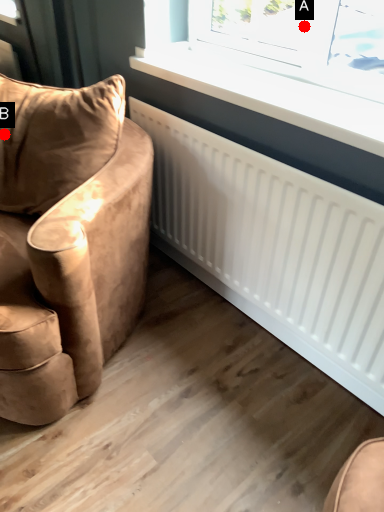
Question: Two points are circled on the image, labeled by A and B beside each circle. Which of the following is the closest to the observer?

Choices:
 (A) A is closer
 (B) B is closer

Answer: (A)